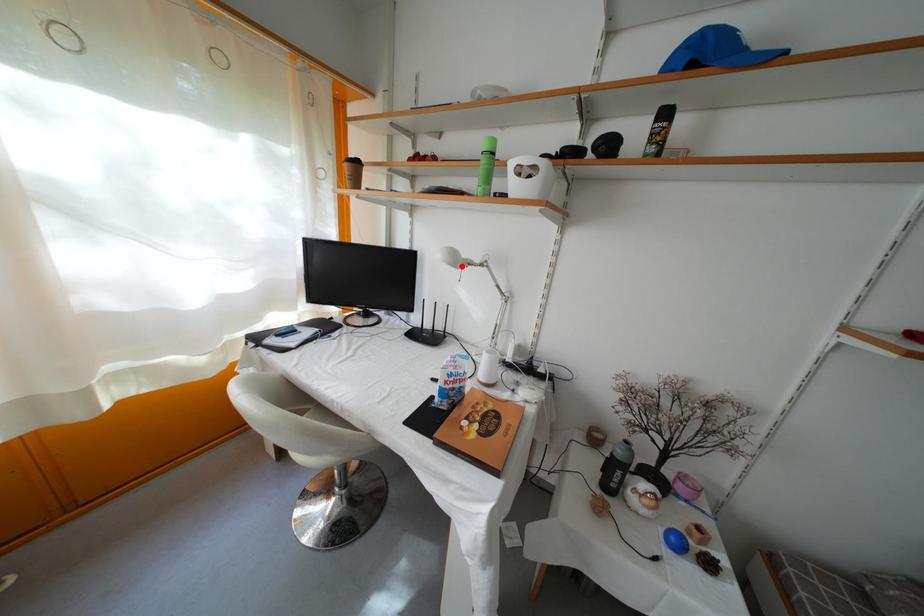
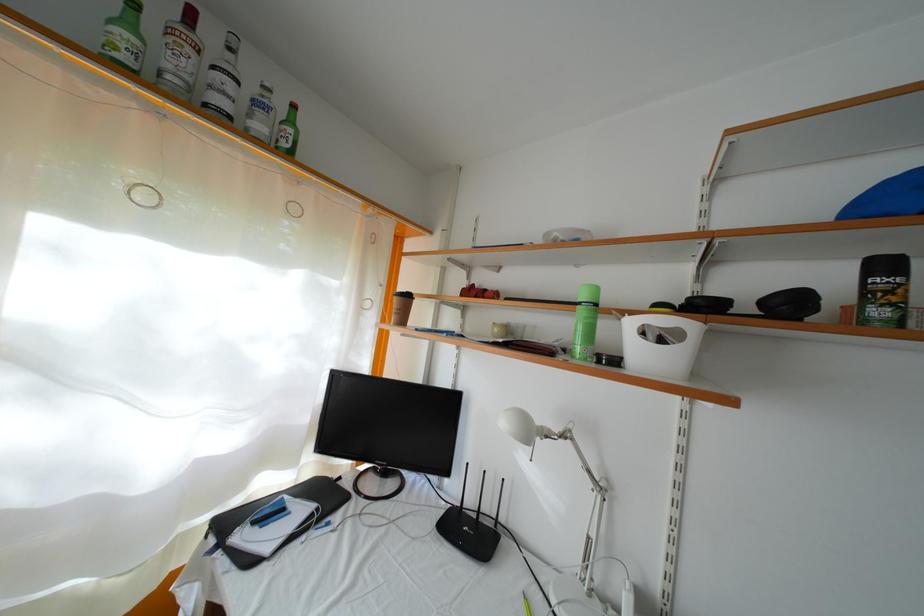
Find the pixel in the second image that matches the highlighted location in the first image.

(535, 439)